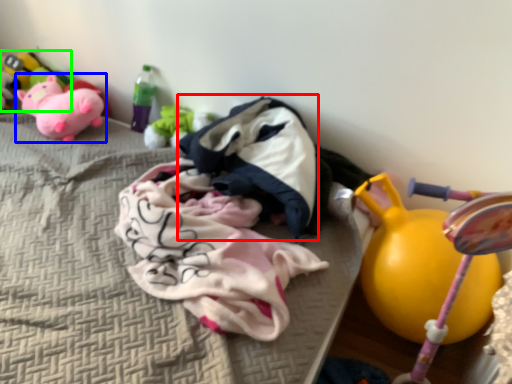
Question: Based on their relative distances, which object is nearer to clothing (highlighted by a red box)? Choose from toy (highlighted by a blue box) and toy (highlighted by a green box).

Choices:
 (A) toy
 (B) toy

Answer: (A)